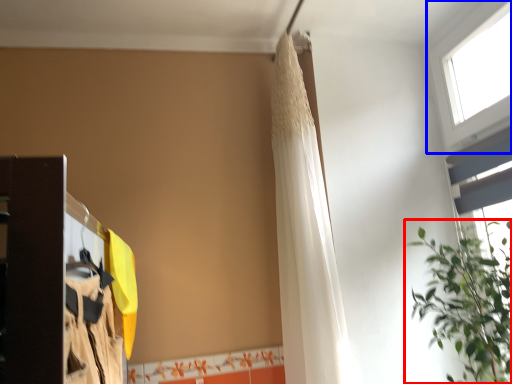
Question: Which object appears farthest to the camera in this image, houseplant (highlighted by a red box) or window (highlighted by a blue box)?

Choices:
 (A) houseplant
 (B) window

Answer: (B)